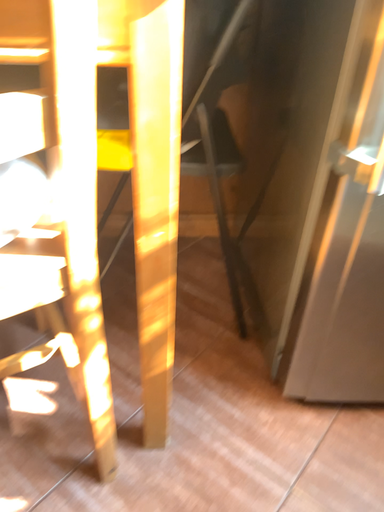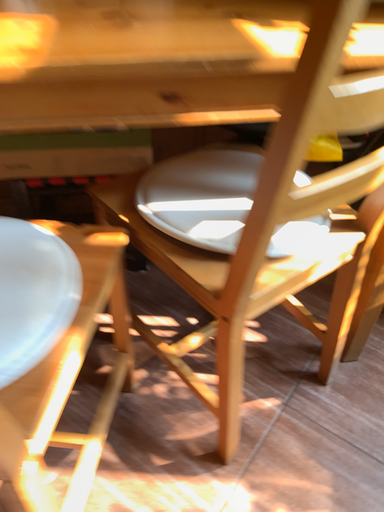
Question: How did the camera likely rotate when shooting the video?

Choices:
 (A) rotated upward
 (B) rotated downward

Answer: (B)